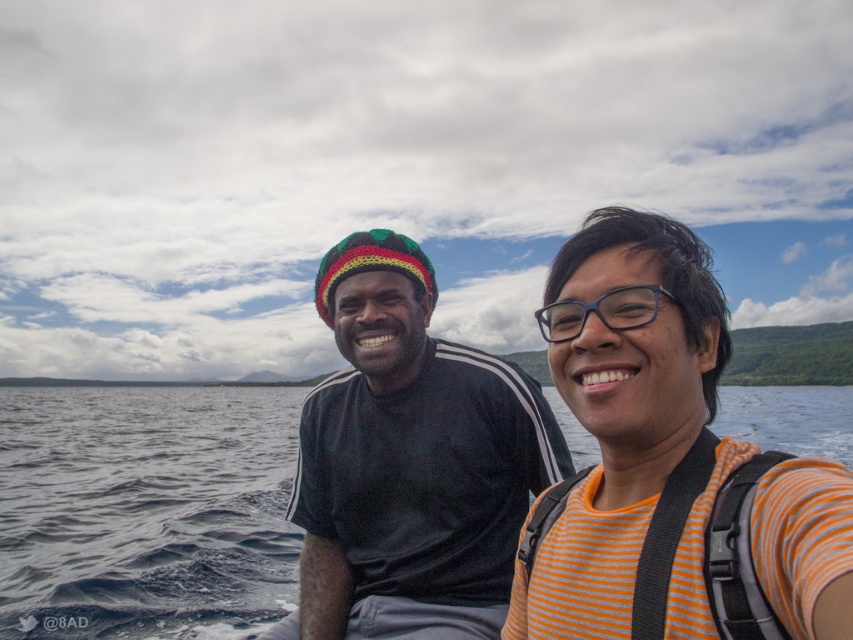
Question: Which point is farther to the camera?

Choices:
 (A) orange striped shirt at right
 (B) dark blue water at center
 (C) black knitted hat at center

Answer: (C)

Question: Considering the relative positions of orange striped shirt at right and dark blue water at center in the image provided, where is orange striped shirt at right located with respect to dark blue water at center?

Choices:
 (A) right
 (B) left

Answer: (B)

Question: Where is black knitted hat at center located in relation to transparent plastic glasses at center in the image?

Choices:
 (A) right
 (B) left

Answer: (B)

Question: Among these objects, which one is nearest to the camera?

Choices:
 (A) black knitted hat at center
 (B) dark blue water at center
 (C) orange striped shirt at right

Answer: (C)

Question: Is orange striped shirt at right positioned behind black knitted hat at center?

Choices:
 (A) no
 (B) yes

Answer: (A)

Question: Which point is closer to the camera?

Choices:
 (A) black knitted hat at center
 (B) orange striped shirt at right
 (C) transparent plastic glasses at center

Answer: (B)